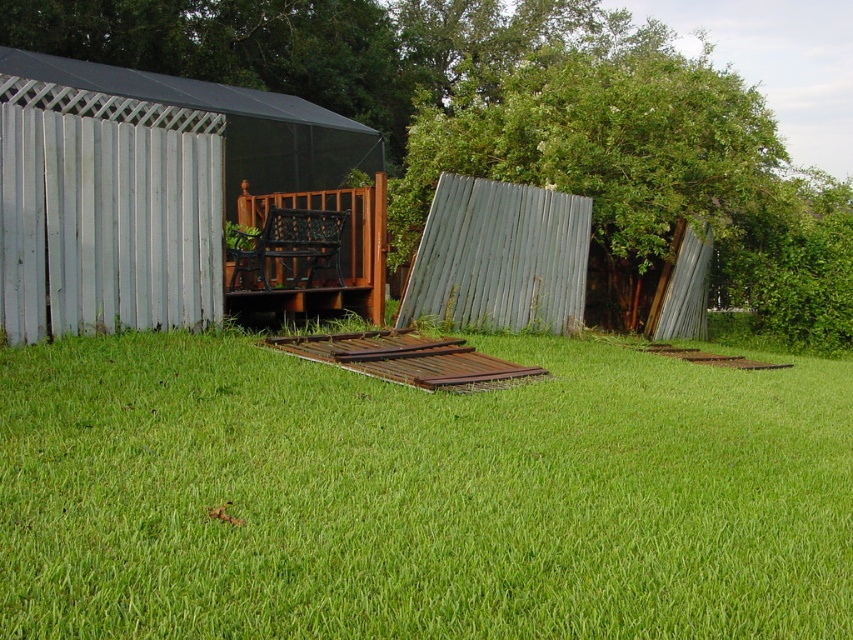
The image size is (853, 640). What do you see at coordinates (140, 188) in the screenshot?
I see `metallic corrugated hut at left` at bounding box center [140, 188].

Which is behind, point (277, 108) or point (654, 184)?

The point (277, 108) is more distant.

Find the location of a particular element. The width and height of the screenshot is (853, 640). metallic corrugated hut at left is located at coordinates (140, 188).

Is point (108, 369) closer to viewer compared to point (737, 179)?

Yes, point (108, 369) is in front of point (737, 179).

Is green grass at center to the left of green corrugated metal at upper right from the viewer's perspective?

Correct, you'll find green grass at center to the left of green corrugated metal at upper right.

Does point (144, 428) come farther from viewer compared to point (759, 106)?

That is False.

Identify the location of green grass at center. (418, 496).

Is the position of green grass at center more distant than that of metallic corrugated hut at left?

No, it is in front of metallic corrugated hut at left.

Who is lower down, green grass at center or metallic corrugated hut at left?

green grass at center

Who is more distant from viewer, (73,592) or (334,145)?

Positioned behind is point (334,145).

Identify the location of green grass at center. (418, 496).